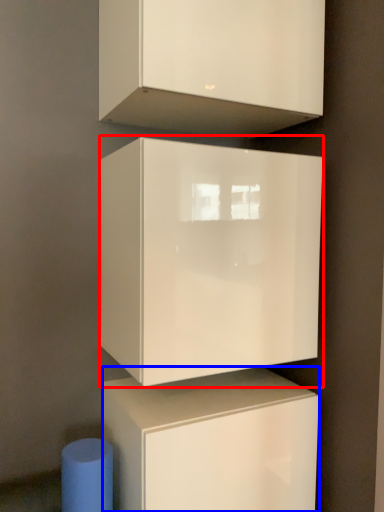
Question: Which point is closer to the camera, cabinetry (highlighted by a red box) or cabinetry (highlighted by a blue box)?

Choices:
 (A) cabinetry
 (B) cabinetry

Answer: (A)